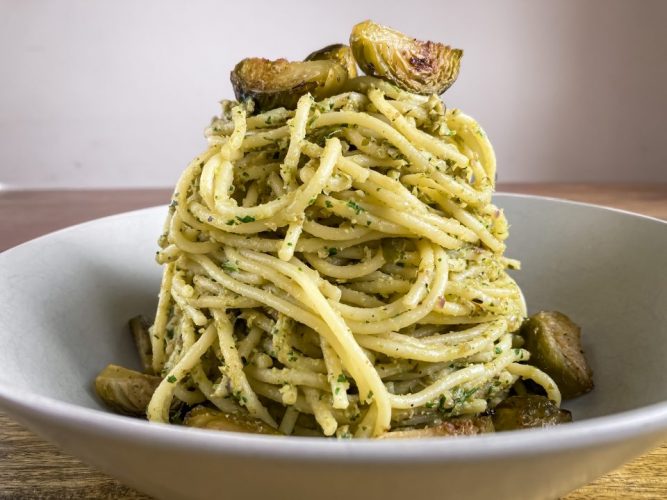
The height and width of the screenshot is (500, 667). I want to click on bowl, so click(x=39, y=298).